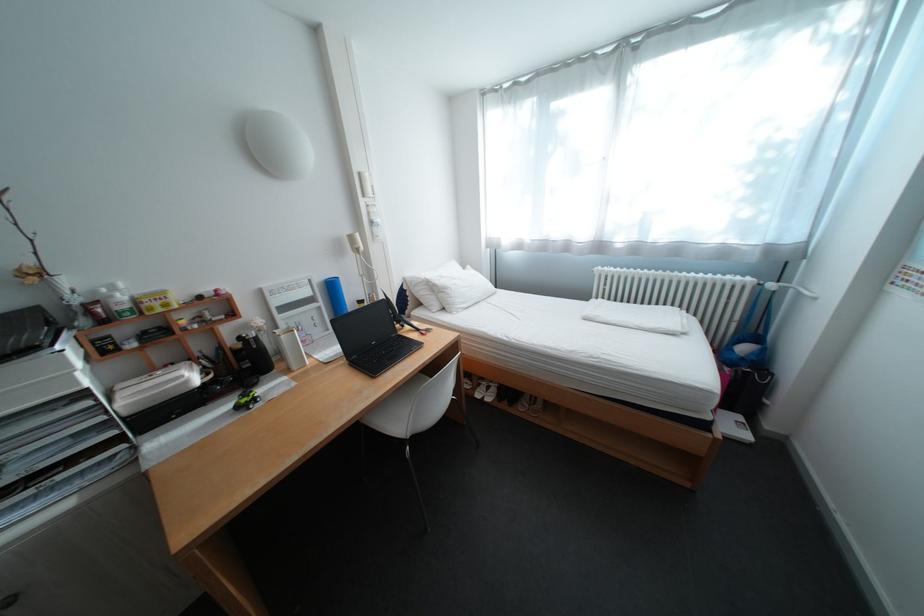
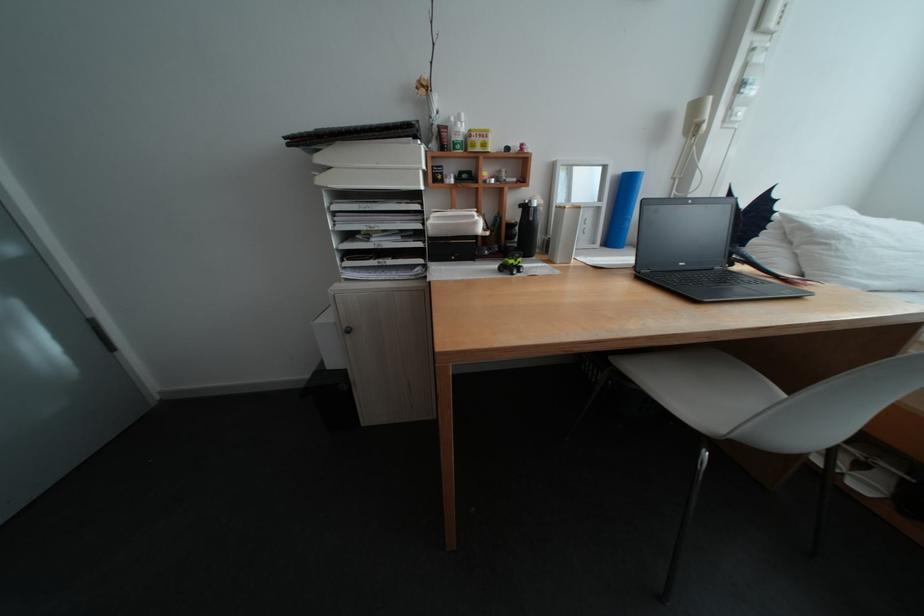
In the second image, find the point that corresponds to the point at 385,344 in the first image.

(694, 265)